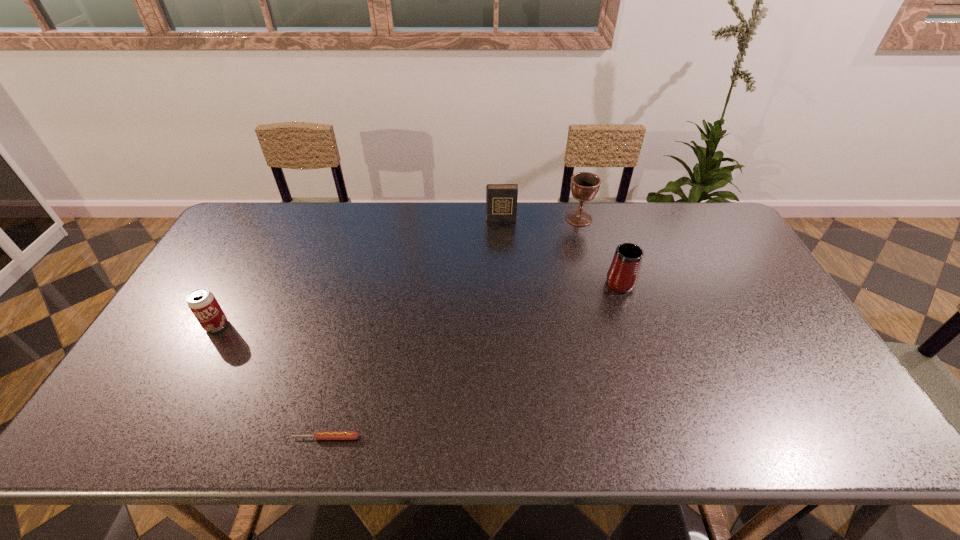
The width and height of the screenshot is (960, 540). What are the coordinates of `free space located on the side of the third farthest object with the handle` in the screenshot? It's located at (593, 201).

Locate an element on the screen. The width and height of the screenshot is (960, 540). free space located on the side of the third farthest object with the handle is located at coordinates (604, 233).

Find the location of `vacant position located on the front of the fourth farthest object`. vacant position located on the front of the fourth farthest object is located at coordinates (204, 349).

In order to click on free space located on the left of the second object from left to right in this screenshot , I will do `click(217, 437)`.

I want to click on chalice positioned at the far edge, so click(x=584, y=185).

You are a GUI agent. You are given a task and a screenshot of the screen. Output one action in this format:
    pyautogui.click(x=<x>, y=<y>)
    Task: Click on the diary at the far edge
    The height and width of the screenshot is (540, 960).
    Given the screenshot: What is the action you would take?
    click(x=501, y=199)

Locate an element on the screen. The height and width of the screenshot is (540, 960). object that is at the near edge is located at coordinates (319, 435).

Locate an element on the screen. object that is at the left edge is located at coordinates (203, 304).

Locate an element on the screen. free point at the far edge is located at coordinates (337, 212).

The width and height of the screenshot is (960, 540). I want to click on free space at the left edge, so click(138, 372).